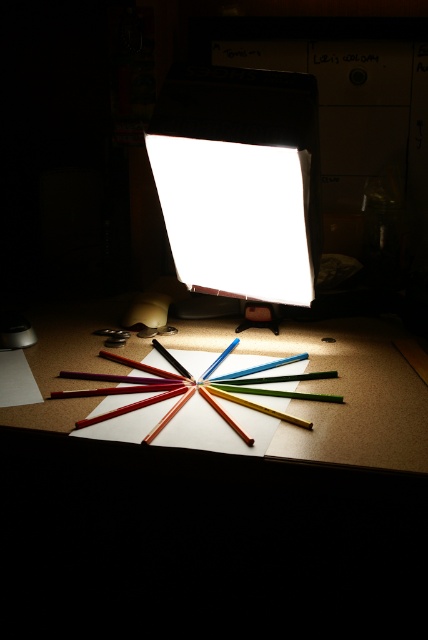
You are an artist trying to place a new pencil on the desk. You want to place it closer to you than the point at [413,387] but still within the circle of colored pencils. Can you place it at point [309,225]?

Yes, you can place the pencil at point [309,225] because it is closer to the viewer than point [413,387] and within the circle of colored pencils.

You are an artist trying to set up your workspace. You have a white matte lampshade at center and a wooden table at center. Which object is positioned higher in the scene?

The white matte lampshade at center is located above the wooden table at center, so it is positioned higher in the scene.

You are standing in the workspace and want to adjust the white matte lampshade at center. If your outstretched hand can reach up to 36 inches, will you be able to touch the lampshade?

The white matte lampshade at center is 36.94 inches away from the viewer. Since your hand can only reach up to 36 inches, you cannot quite touch the lampshade.